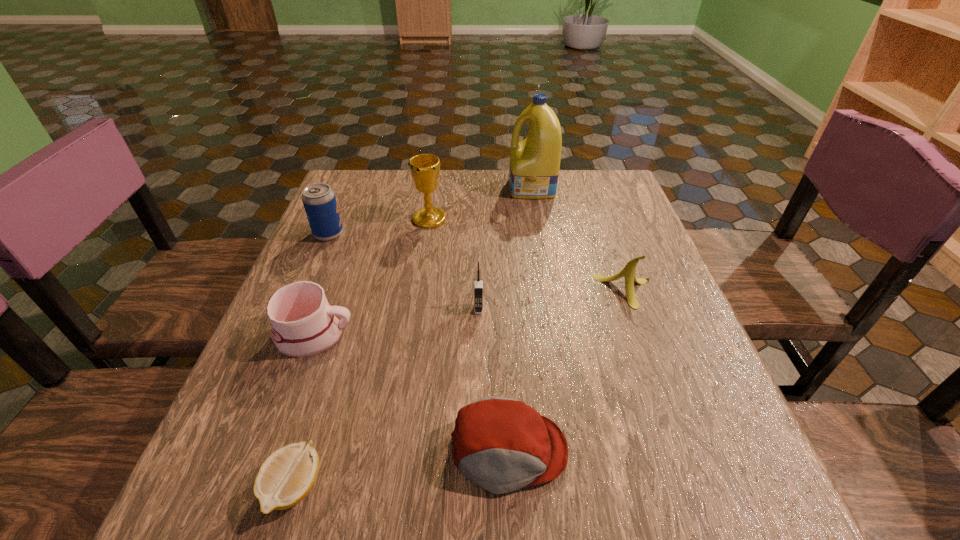
Find the location of a particular element. This screenshot has width=960, height=540. free space at the left edge of the desktop is located at coordinates (240, 389).

Identify the location of vacant area at the right edge of the desktop. tap(641, 245).

Locate an element on the screen. free space at the far left corner is located at coordinates (367, 173).

You are a GUI agent. You are given a task and a screenshot of the screen. Output one action in this format:
    pyautogui.click(x=<x>, y=<y>)
    Task: Click on the vacant area at the far right corner
    This screenshot has width=960, height=540.
    Given the screenshot: What is the action you would take?
    pyautogui.click(x=597, y=185)

This screenshot has width=960, height=540. I want to click on free space at the near right corner of the desktop, so click(719, 507).

The height and width of the screenshot is (540, 960). In order to click on vacant region between the cap and the cellular telephone in this screenshot , I will do point(493,380).

The height and width of the screenshot is (540, 960). I want to click on vacant space in between the mug and the shortest object, so click(x=304, y=411).

This screenshot has height=540, width=960. In order to click on free space between the rightmost object and the mug in this screenshot , I will do `click(469, 313)`.

Locate an element on the screen. The height and width of the screenshot is (540, 960). vacant space in between the beer can and the mug is located at coordinates click(322, 285).

Locate an element on the screen. empty location between the shortest object and the mug is located at coordinates (304, 411).